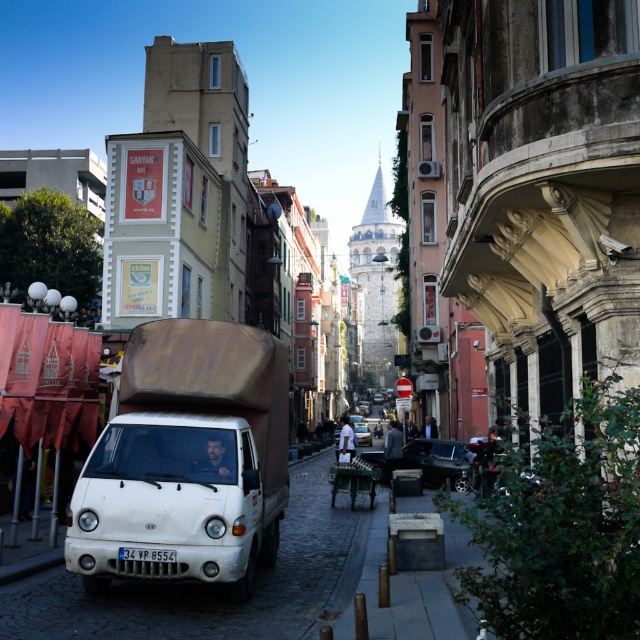
Which of these two, white matte truck at lower left or shiny black car at right, stands taller?

With more height is white matte truck at lower left.

Image resolution: width=640 pixels, height=640 pixels. Identify the location of white matte truck at lower left. (188, 458).

You are a GUI agent. You are given a task and a screenshot of the screen. Output one action in this format:
    pyautogui.click(x=<x>, y=<y>)
    Task: Click on the white matte truck at lower left
    The height and width of the screenshot is (640, 640).
    Given the screenshot: What is the action you would take?
    pyautogui.click(x=188, y=458)

Can you confirm if shiny black car at right is positioned to the right of white plastic license plate at center?

Yes, shiny black car at right is to the right of white plastic license plate at center.

Can you confirm if shiny black car at right is positioned below white plastic license plate at center?

Correct, shiny black car at right is located below white plastic license plate at center.

Locate an element on the screen. shiny black car at right is located at coordinates (438, 460).

Which is below, white matte truck at lower left or metallic silver car at center?

metallic silver car at center is below.

Can you confirm if white matte truck at lower left is smaller than metallic silver car at center?

Yes.

Is point (88, 500) positioned before point (384, 397)?

Yes, it is.

You are a GUI agent. You are given a task and a screenshot of the screen. Output one action in this format:
    pyautogui.click(x=<x>, y=<y>)
    Task: Click on the white matte truck at lower left
    This screenshot has height=640, width=640.
    Given the screenshot: What is the action you would take?
    pyautogui.click(x=188, y=458)